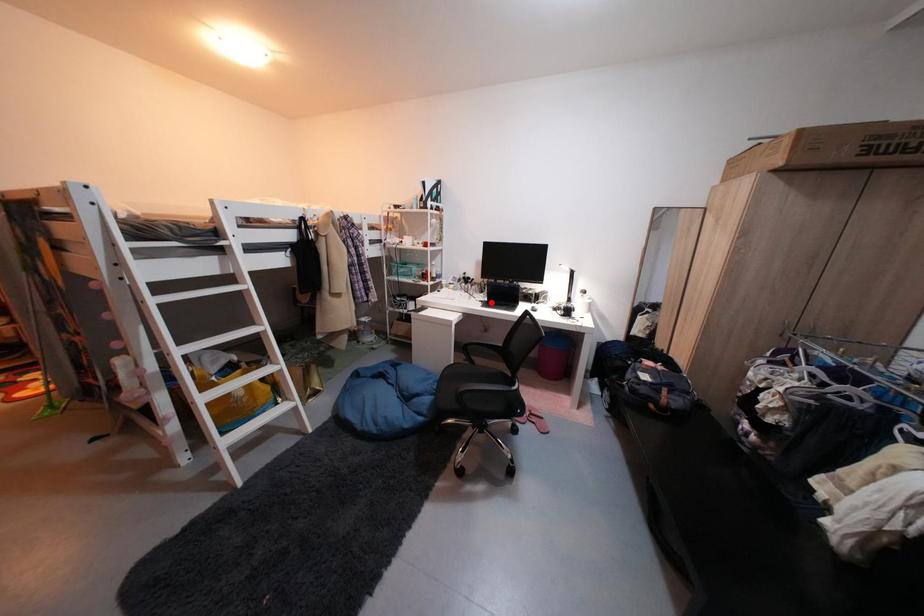
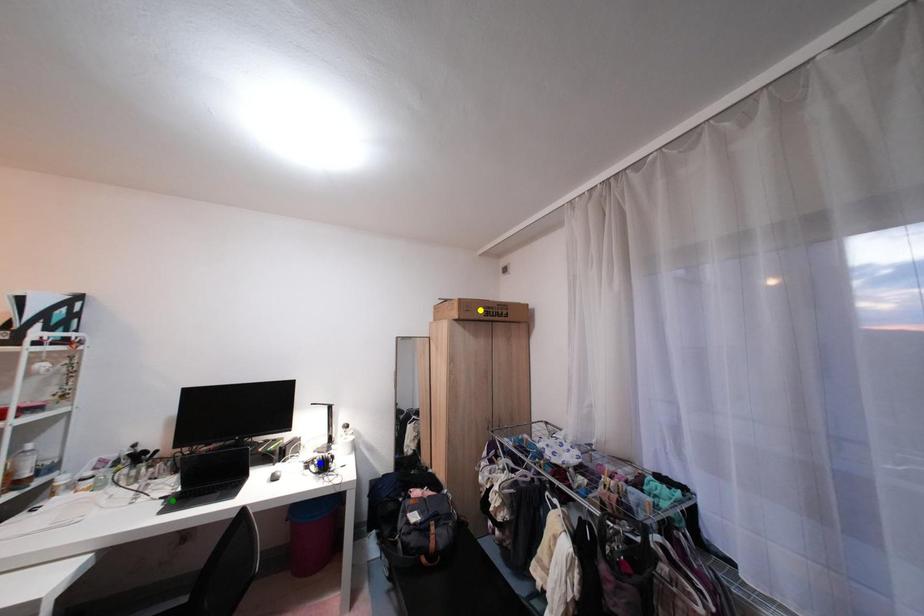
Question: I am providing you with two images of the same scene from different viewpoints. A red point is marked on the first image. You are given multiple points on the second image. Which mark in image 2 goes with the point in image 1?

Choices:
 (A) green point
 (B) yellow point
 (C) blue point

Answer: (A)